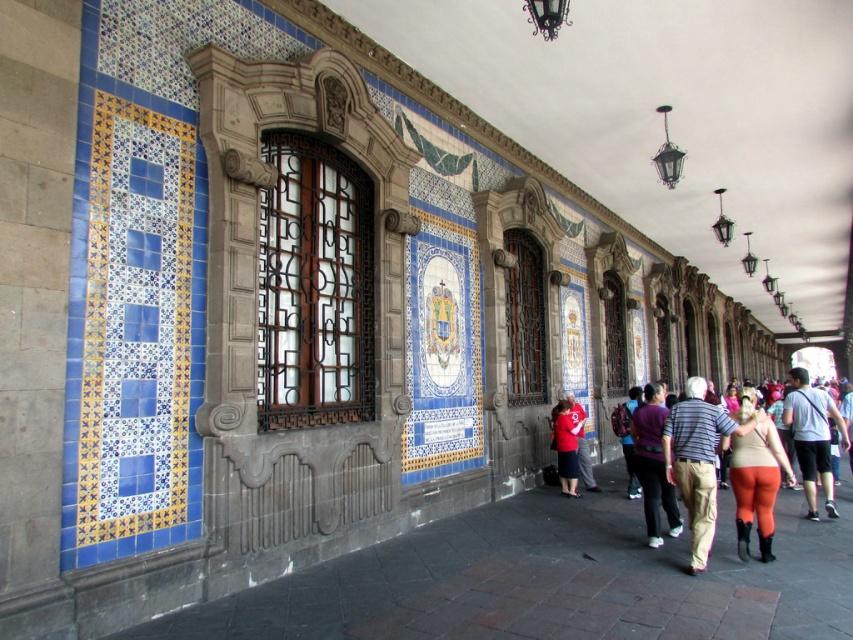
Question: Which of the following is the farthest from the observer?

Choices:
 (A) white cotton shirt at right
 (B) wrought iron window at center

Answer: (B)

Question: Is brown wooden window at center to the left of matte beige pants at center from the viewer's perspective?

Choices:
 (A) no
 (B) yes

Answer: (B)

Question: Is brown wooden window at center bigger than matte red shirt at center?

Choices:
 (A) yes
 (B) no

Answer: (A)

Question: Estimate the real-world distances between objects in this image. Which object is closer to the matte beige pants at center?

Choices:
 (A) wrought iron window at center
 (B) matte beige leggings at center right
 (C) purple fabric at center

Answer: (C)

Question: Is brown wooden window at center to the right of matte beige leggings at center right from the viewer's perspective?

Choices:
 (A) yes
 (B) no

Answer: (B)

Question: Among these points, which one is farthest from the camera?

Choices:
 (A) (572, 435)
 (B) (659, 436)

Answer: (A)